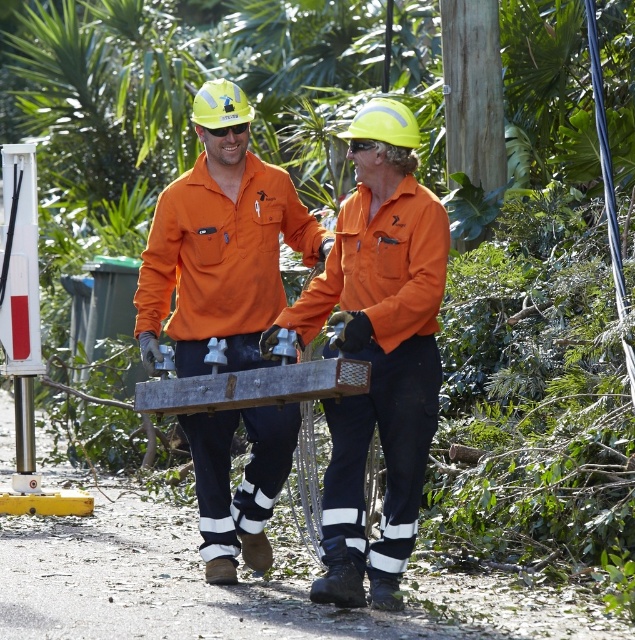
You are a safety inspector checking the positioning of workers in the image. The coordinates provided indicate a specific location. Which worker is closer to the point marked at coordinates point (377,352)?

The point marked at coordinates point (377,352) marks orange matte workwear at center, so the worker wearing orange matte workwear at center is closer to the point.

Based on the photo, you are a safety inspector observing two workers in orange attire. You notice that one of them is wearing orange matte workwear at center and the other has a matte orange shirt at center. According to the safety protocol, workers must keep a 1 meter distance between their clothing items. Can you determine if their clothing positions comply with the safety rule?

The orange matte workwear at center is to the right of matte orange shirt at center, but the distance between them is not specified. The safety protocol requires a 1 meter distance between clothing items, but the description only mentions their spatial arrangement, not the actual distance. Therefore, compliance cannot be confirmed solely based on the provided information.